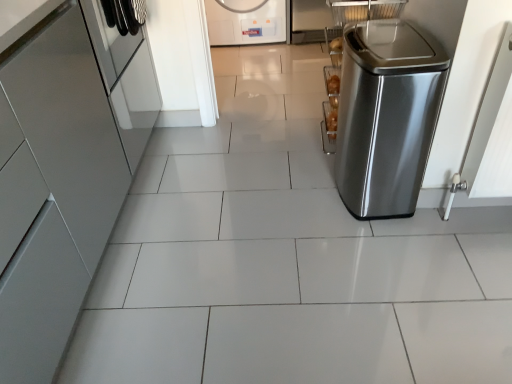
Question: In which direction should I rotate to look at white glossy washing machine at upper center, the second home appliance when ordered from left to right?

Choices:
 (A) right
 (B) left

Answer: (B)

Question: From a real-world perspective, does glossy metallic cabinet at left, which is counted as the 2th home appliance, starting from the back, sit lower than white glossy washing machine at upper center, arranged as the second home appliance when viewed from the right?

Choices:
 (A) yes
 (B) no

Answer: (B)

Question: Is glossy metallic cabinet at left, marked as the 3th home appliance in a right-to-left arrangement, positioned with its back to white glossy washing machine at upper center, arranged as the second home appliance when viewed from the right?

Choices:
 (A) no
 (B) yes

Answer: (A)

Question: Is white glossy washing machine at upper center, arranged as the second home appliance when viewed from the right, surrounded by glossy metallic cabinet at left, positioned as the first home appliance in left-to-right order?

Choices:
 (A) no
 (B) yes

Answer: (A)

Question: From the image's perspective, is glossy metallic cabinet at left, marked as the 3th home appliance in a right-to-left arrangement, located beneath white glossy washing machine at upper center, the second home appliance when ordered from left to right?

Choices:
 (A) yes
 (B) no

Answer: (A)

Question: Is glossy metallic cabinet at left, positioned as the first home appliance in left-to-right order, to the right of white glossy washing machine at upper center, the second home appliance when ordered from left to right, from the viewer's perspective?

Choices:
 (A) yes
 (B) no

Answer: (B)

Question: Considering the relative positions of glossy metallic cabinet at left, marked as the 3th home appliance in a right-to-left arrangement, and white glossy washing machine at upper center, the 3th home appliance viewed from the front, in the image provided, is glossy metallic cabinet at left, marked as the 3th home appliance in a right-to-left arrangement, to the left of white glossy washing machine at upper center, the 3th home appliance viewed from the front, from the viewer's perspective?

Choices:
 (A) no
 (B) yes

Answer: (B)

Question: Is stainless steel trash can at right, which appears as the first home appliance when viewed from the right, to the right of glossy metallic cabinet at left, positioned as the first home appliance in left-to-right order, from the viewer's perspective?

Choices:
 (A) no
 (B) yes

Answer: (B)

Question: From a real-world perspective, is stainless steel trash can at right, the first home appliance positioned from the front, positioned over glossy metallic cabinet at left, the 2th home appliance when ordered from front to back, based on gravity?

Choices:
 (A) yes
 (B) no

Answer: (B)

Question: Considering the relative sizes of stainless steel trash can at right, the first home appliance positioned from the front, and glossy metallic cabinet at left, which is counted as the 2th home appliance, starting from the back, in the image provided, is stainless steel trash can at right, the first home appliance positioned from the front, wider than glossy metallic cabinet at left, which is counted as the 2th home appliance, starting from the back,?

Choices:
 (A) yes
 (B) no

Answer: (B)

Question: Considering the relative sizes of stainless steel trash can at right, which appears as the first home appliance when viewed from the right, and glossy metallic cabinet at left, the 2th home appliance when ordered from front to back, in the image provided, is stainless steel trash can at right, which appears as the first home appliance when viewed from the right, thinner than glossy metallic cabinet at left, the 2th home appliance when ordered from front to back,?

Choices:
 (A) yes
 (B) no

Answer: (A)

Question: Does stainless steel trash can at right, which ranks as the third home appliance in back-to-front order, have a larger size compared to glossy metallic cabinet at left, the 2th home appliance when ordered from front to back?

Choices:
 (A) no
 (B) yes

Answer: (A)

Question: Could you tell me if stainless steel trash can at right, which appears as the first home appliance when viewed from the right, is turned towards glossy metallic cabinet at left, marked as the 3th home appliance in a right-to-left arrangement?

Choices:
 (A) yes
 (B) no

Answer: (A)

Question: Is glossy metallic cabinet at left, which is counted as the 2th home appliance, starting from the back, far away from stainless steel trash can at right, which ranks as the third home appliance in back-to-front order?

Choices:
 (A) yes
 (B) no

Answer: (A)